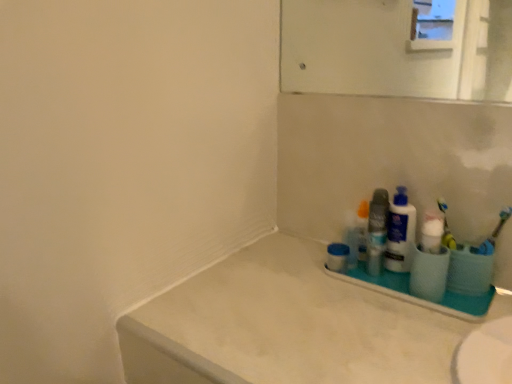
Locate an element on the screen. The image size is (512, 384). vacant area that is in front of translucent plastic bottles at right is located at coordinates (389, 315).